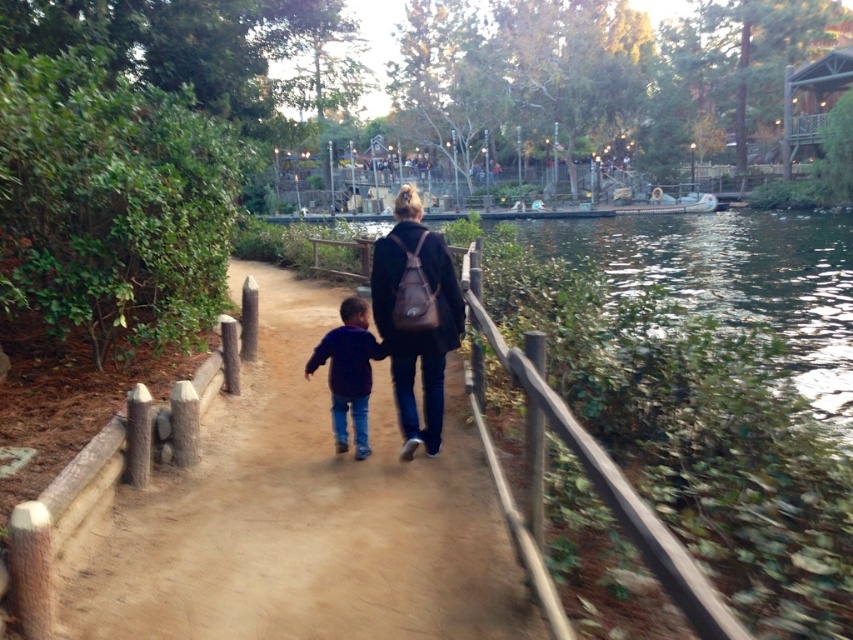
Question: Estimate the real-world distances between objects in this image. Which object is closer to the matte brown backpack at center?

Choices:
 (A) greenish water at center
 (B) dark blue fleece at center

Answer: (B)

Question: Which of the following is the closest to the observer?

Choices:
 (A) greenish water at center
 (B) dirt path at center
 (C) dark blue fleece at center

Answer: (B)

Question: Can you confirm if dirt path at center is bigger than matte brown backpack at center?

Choices:
 (A) yes
 (B) no

Answer: (B)

Question: Which of the following is the farthest from the observer?

Choices:
 (A) (314, 355)
 (B) (427, 358)
 (C) (749, 253)

Answer: (C)

Question: Does dirt path at center lie behind greenish water at center?

Choices:
 (A) no
 (B) yes

Answer: (A)

Question: Is greenish water at center positioned at the back of dark blue fleece at center?

Choices:
 (A) no
 (B) yes

Answer: (A)